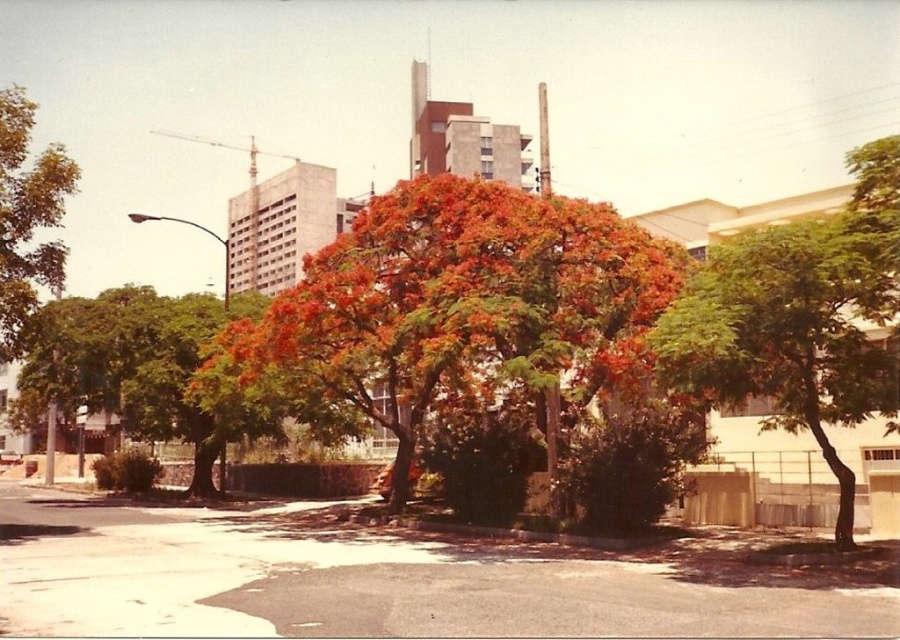
Question: Which of the following is the closest to the observer?

Choices:
 (A) (609, 372)
 (B) (677, 385)

Answer: (B)

Question: Does green leafy tree at center appear on the left side of green leafy tree at left?

Choices:
 (A) no
 (B) yes

Answer: (A)

Question: Which point is farther from the camera taking this photo?

Choices:
 (A) (848, 289)
 (B) (46, 148)
 (C) (374, 308)

Answer: (B)

Question: Is orange leafy tree at center bigger than green leafy tree at left?

Choices:
 (A) yes
 (B) no

Answer: (B)

Question: Is orange leafy tree at center below green leafy tree at left?

Choices:
 (A) no
 (B) yes

Answer: (B)

Question: Based on their relative distances, which object is farther from the green leafy tree at center?

Choices:
 (A) orange leafy tree at center
 (B) green leafy tree at left

Answer: (B)